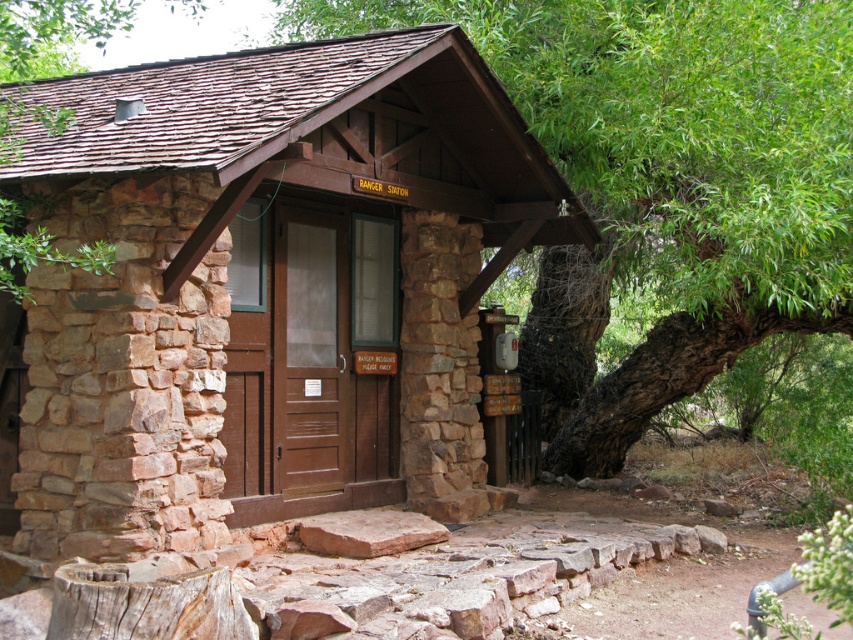
Which is above, brown stone cabin at center or green leafy tree at center?

Positioned higher is green leafy tree at center.

Is brown stone cabin at center closer to the viewer compared to green leafy tree at center?

No, it is behind green leafy tree at center.

Is point (115, 314) more distant than point (585, 356)?

No, (115, 314) is closer to viewer.

Locate an element on the screen. brown stone cabin at center is located at coordinates (267, 285).